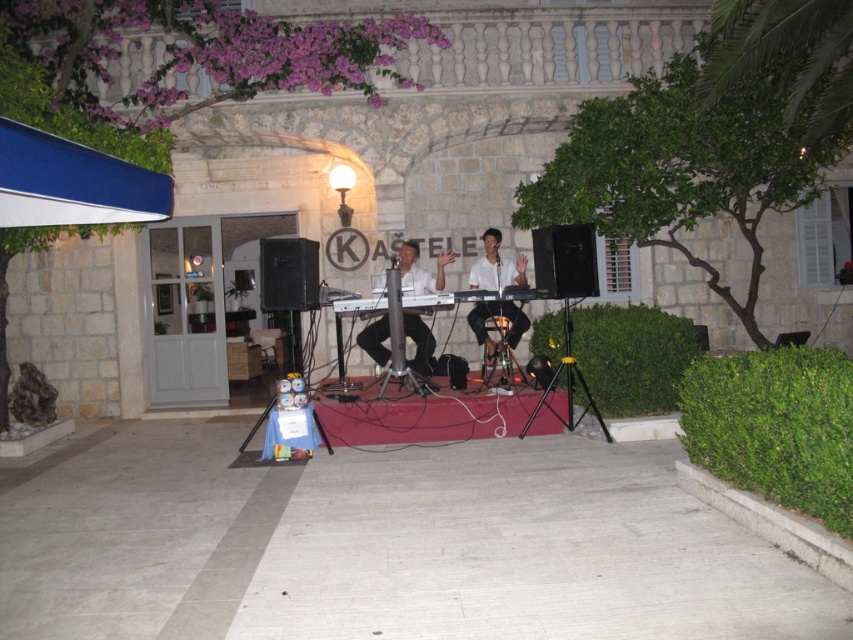
You are standing in front of the stage and want to hand a gift to the performer playing the matte white keyboard at center. If you can only throw the gift up to 8 meters, will you be able to reach them?

The distance between you and the matte white keyboard at center is 9.02 meters, which exceeds your throwing range of 8 meters. Therefore, you cannot reach the performer with the gift.

You are a photographer setting up for a night shoot at the stage. You need to place a spotlight on the left side of the stage. Which object should you aim the spotlight at to ensure it illuminates the matte white keyboard at center and the white matte keyboard at center properly?

The matte white keyboard at center is to the left of the white matte keyboard at center. To illuminate both properly, aim the spotlight at the white matte keyboard at center since it is on the right side, ensuring the light reaches both instruments.

You are a stagehand setting up a microphone stand between the two performers. The keyboardist is at the matte white keyboard at center and the drummer is at the white matte keyboard at center. Is there enough space to place the microphone stand between them?

The distance between the matte white keyboard at center and the white matte keyboard at center is 29.96 inches. A standard microphone stand requires about 2 feet of space. Since 29.96 inches is approximately 2.5 feet, there is sufficient space to place the microphone stand between them.